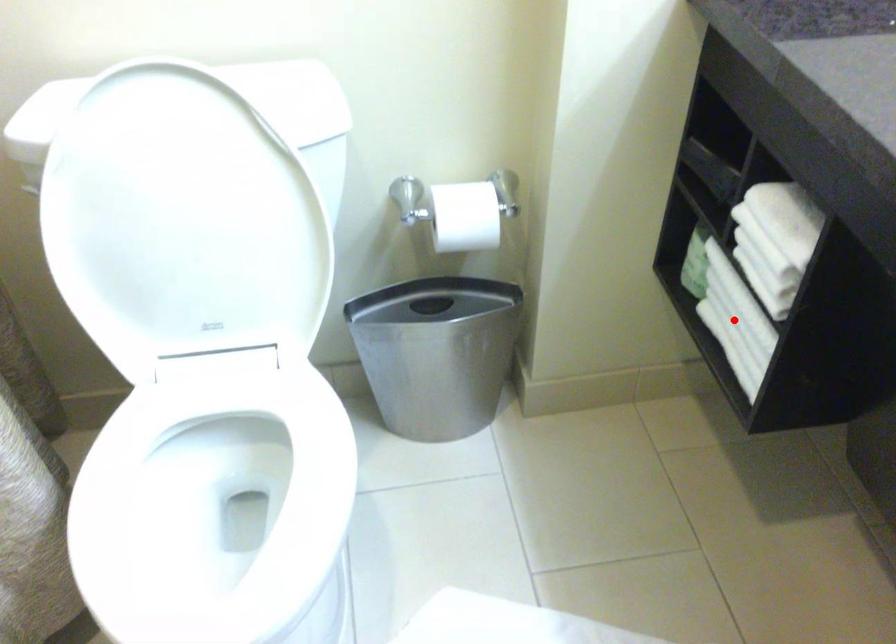
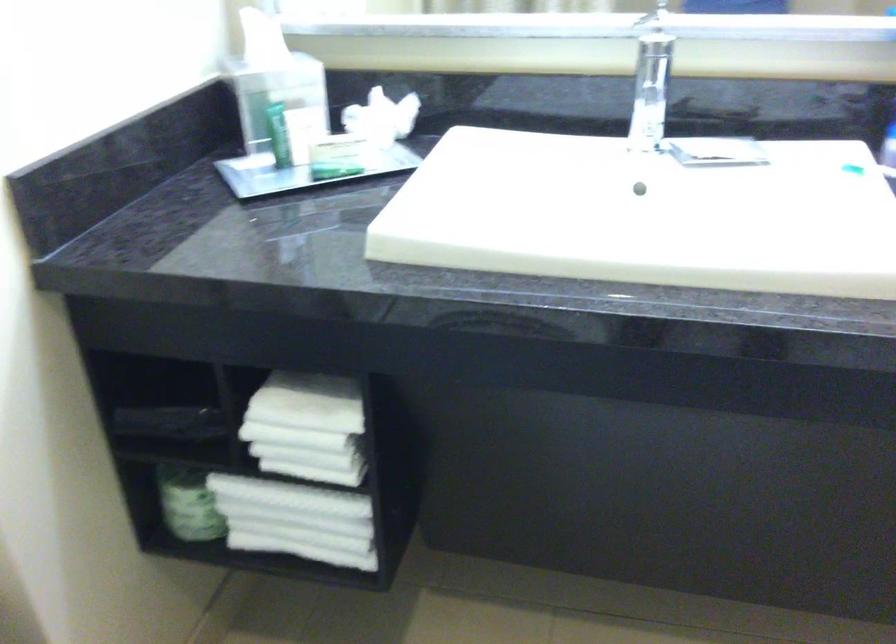
Where in the second image is the point corresponding to the highlighted location from the first image?

(296, 520)